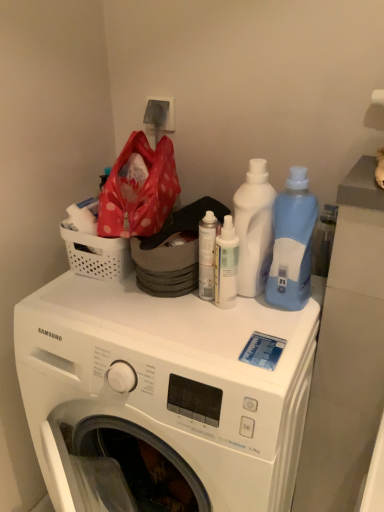
Identify the location of vacant area that is in front of white glossy spray can at center, arranged as the 3th cleaning product when viewed from the right. The height and width of the screenshot is (512, 384). click(x=228, y=344).